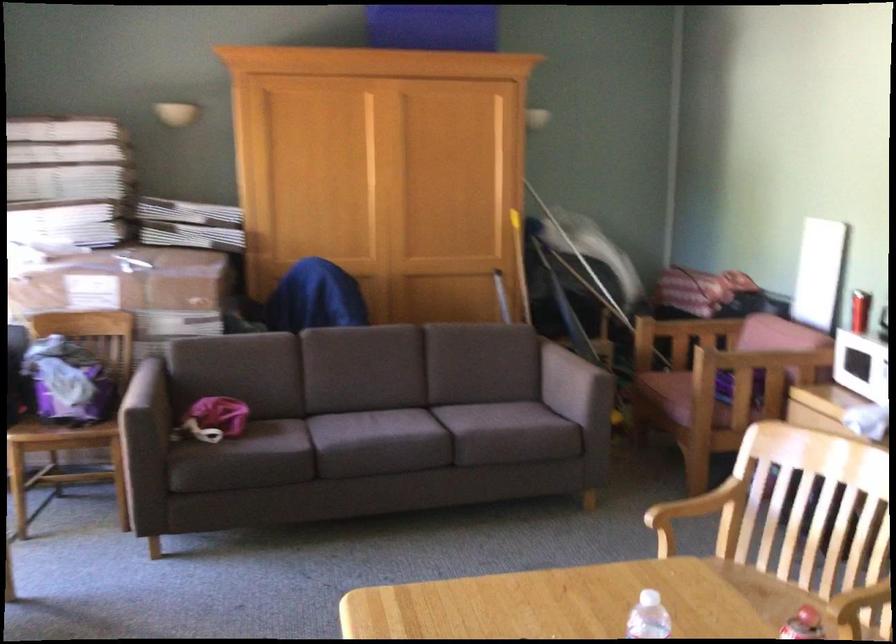
At what (x,y) coordinates should I click in order to perform the action: click on pink cushioned surface. Please return your answer as a coordinate pair (x, y). Image resolution: width=896 pixels, height=644 pixels. Looking at the image, I should click on (669, 393).